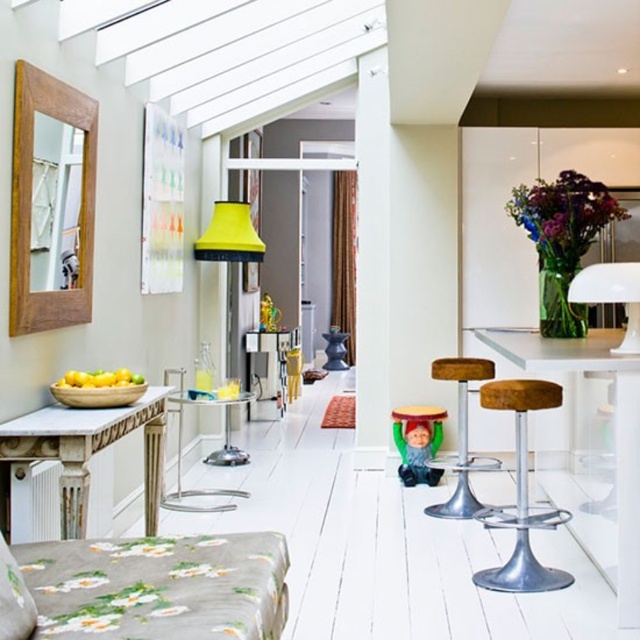
Does clear glass table at center have a smaller size compared to white glossy table lamp at upper right?

No, clear glass table at center is not smaller than white glossy table lamp at upper right.

Does point (211, 497) lie behind point (611, 280)?

Yes, point (211, 497) is behind point (611, 280).

Measure the distance between clear glass table at center and camera.

clear glass table at center and camera are 16.34 feet apart.

The height and width of the screenshot is (640, 640). What are the coordinates of `clear glass table at center` in the screenshot? It's located at (209, 452).

Between metallic silver bar stool at right and white glossy table lamp at upper right, which one is positioned higher?

white glossy table lamp at upper right

Is point (515, 424) farther from camera compared to point (621, 275)?

Yes.

Which is behind, point (552, 570) or point (580, 285)?

The point (552, 570) is more distant.

At what (x,y) coordinates should I click in order to perform the action: click on metallic silver bar stool at right. Please return your answer as a coordinate pair (x, y). The height and width of the screenshot is (640, 640). Looking at the image, I should click on (522, 493).

Can you confirm if white glossy table lamp at upper right is smaller than brown leather stool at center?

Incorrect, white glossy table lamp at upper right is not smaller in size than brown leather stool at center.

Who is positioned more to the left, white glossy table lamp at upper right or brown leather stool at center?

brown leather stool at center

What do you see at coordinates (611, 296) in the screenshot? I see `white glossy table lamp at upper right` at bounding box center [611, 296].

Locate an element on the screen. The image size is (640, 640). white glossy table lamp at upper right is located at coordinates (611, 296).